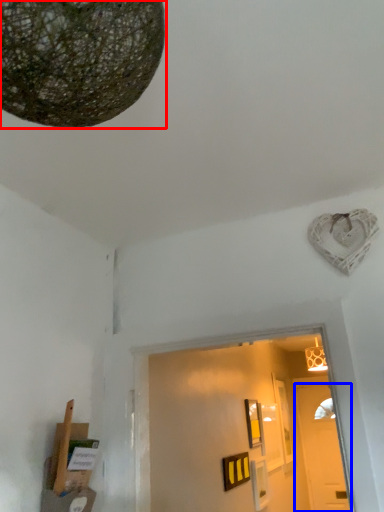
Question: Among these objects, which one is farthest to the camera, lamp (highlighted by a red box) or door (highlighted by a blue box)?

Choices:
 (A) lamp
 (B) door

Answer: (B)